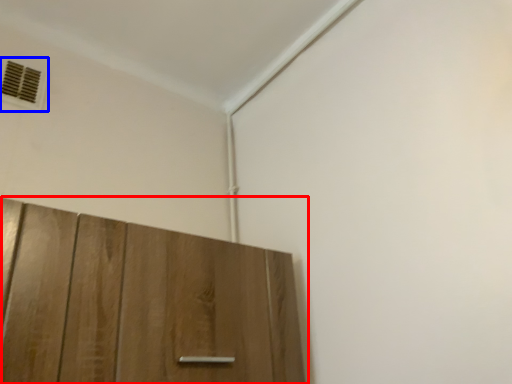
Question: Which of the following is the farthest to the observer, cupboard (highlighted by a red box) or air conditioning (highlighted by a blue box)?

Choices:
 (A) cupboard
 (B) air conditioning

Answer: (B)